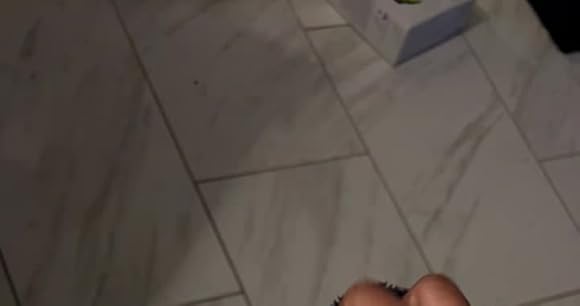
Locate an element on the screen. This screenshot has height=306, width=580. corners is located at coordinates (393, 62), (561, 49), (538, 158), (366, 149), (304, 24), (195, 175), (239, 287).